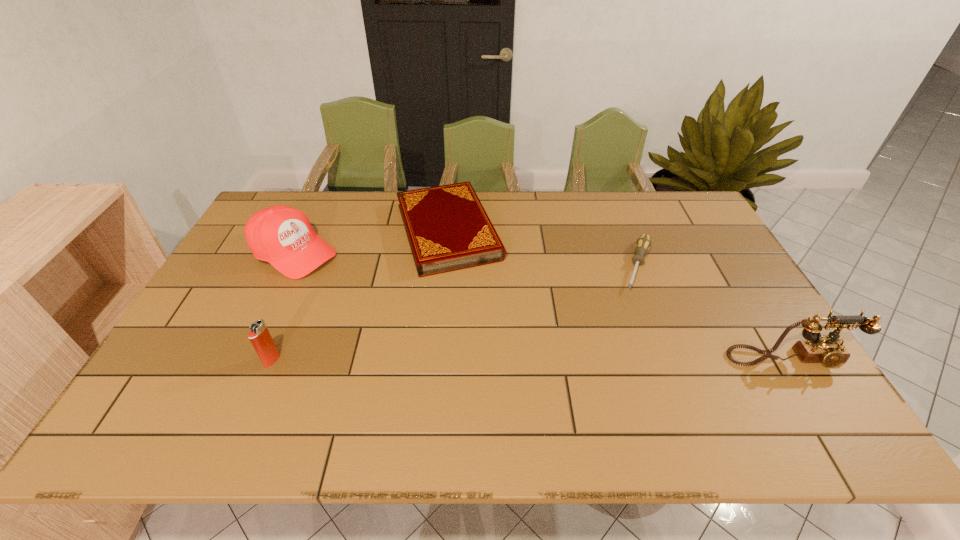
The height and width of the screenshot is (540, 960). I want to click on igniter, so click(x=259, y=335).

Identify the location of telephone. This screenshot has width=960, height=540. (829, 350).

The width and height of the screenshot is (960, 540). Identify the location of the third object from right to left. (448, 229).

At what (x,y) coordinates should I click in order to perform the action: click on screwdriver. Please return your answer as a coordinate pair (x, y). Image resolution: width=960 pixels, height=540 pixels. Looking at the image, I should click on (643, 244).

Image resolution: width=960 pixels, height=540 pixels. Find the location of `the second object from right to left`. the second object from right to left is located at coordinates click(x=643, y=244).

The width and height of the screenshot is (960, 540). What are the coordinates of `baseball cap` in the screenshot? It's located at (281, 235).

Where is `vacant space located on the back of the igniter`? vacant space located on the back of the igniter is located at coordinates pyautogui.click(x=290, y=317).

Locate an element on the screen. free region located on the cover of the hardback book is located at coordinates (496, 364).

Identify the location of free location located on the cover of the hardback book. (470, 299).

Where is `free region located 0.380m on the cover of the hardback book`? This screenshot has width=960, height=540. free region located 0.380m on the cover of the hardback book is located at coordinates (503, 381).